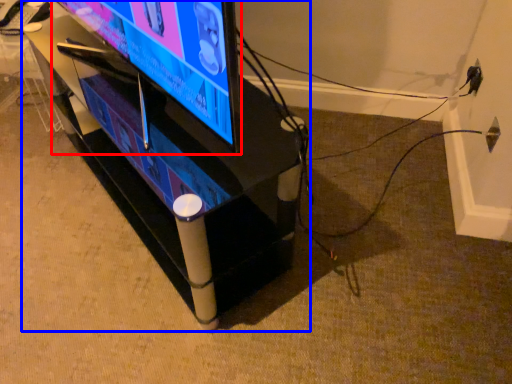
Question: Which object is closer to the camera taking this photo, television (highlighted by a red box) or furniture (highlighted by a blue box)?

Choices:
 (A) television
 (B) furniture

Answer: (A)